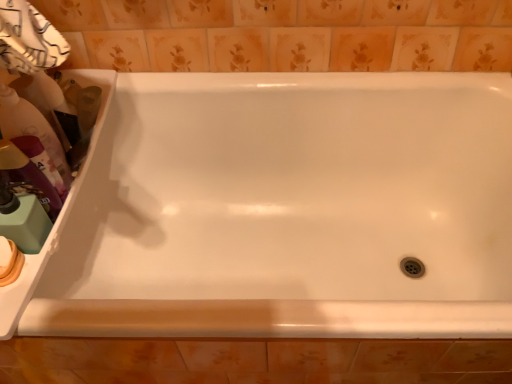
Question: Is white glossy sink at left outside matte plastic bottle at left, which ranks as the 1th cleaning product in top-to-bottom order?

Choices:
 (A) no
 (B) yes

Answer: (B)

Question: From the image's perspective, is white glossy sink at left over matte plastic bottle at left, positioned as the 4th cleaning product in bottom-to-top order?

Choices:
 (A) no
 (B) yes

Answer: (A)

Question: From a real-world perspective, is white glossy sink at left physically above matte plastic bottle at left, which ranks as the 1th cleaning product in top-to-bottom order?

Choices:
 (A) yes
 (B) no

Answer: (B)

Question: Can you confirm if white glossy sink at left is thinner than matte plastic bottle at left, positioned as the 4th cleaning product in bottom-to-top order?

Choices:
 (A) no
 (B) yes

Answer: (A)

Question: Is white glossy sink at left taller than matte plastic bottle at left, positioned as the 4th cleaning product in bottom-to-top order?

Choices:
 (A) yes
 (B) no

Answer: (B)

Question: Considering their positions, is white glossy bathtub at center located in front of or behind matte plastic bottle at left, the 2th cleaning product from the top?

Choices:
 (A) behind
 (B) front

Answer: (B)

Question: Is white glossy bathtub at center bigger or smaller than matte plastic bottle at left, the 2th cleaning product from the top?

Choices:
 (A) small
 (B) big

Answer: (B)

Question: From the image's perspective, is white glossy bathtub at center above or below matte plastic bottle at left, positioned as the third cleaning product in bottom-to-top order?

Choices:
 (A) above
 (B) below

Answer: (B)

Question: Considering the positions of point (352, 87) and point (1, 127), is point (352, 87) closer or farther from the camera than point (1, 127)?

Choices:
 (A) closer
 (B) farther

Answer: (B)

Question: From a real-world perspective, relative to white glossy bathtub at center, is beige matte soap at lower left vertically above or below?

Choices:
 (A) below
 (B) above

Answer: (B)

Question: Looking at their shapes, would you say beige matte soap at lower left is wider or thinner than white glossy bathtub at center?

Choices:
 (A) wide
 (B) thin

Answer: (B)

Question: Relative to white glossy bathtub at center, is beige matte soap at lower left in front or behind?

Choices:
 (A) front
 (B) behind

Answer: (B)

Question: From the image's perspective, relative to white glossy bathtub at center, is beige matte soap at lower left above or below?

Choices:
 (A) below
 (B) above

Answer: (B)

Question: Considering the positions of beige matte soap at lower left and matte purple bottle at left, which appears as the 2th cleaning product when ordered from the bottom, in the image, is beige matte soap at lower left taller or shorter than matte purple bottle at left, which appears as the 2th cleaning product when ordered from the bottom,?

Choices:
 (A) tall
 (B) short

Answer: (B)

Question: Is beige matte soap at lower left inside the boundaries of matte purple bottle at left, which appears as the 2th cleaning product when ordered from the bottom, or outside?

Choices:
 (A) outside
 (B) inside

Answer: (A)